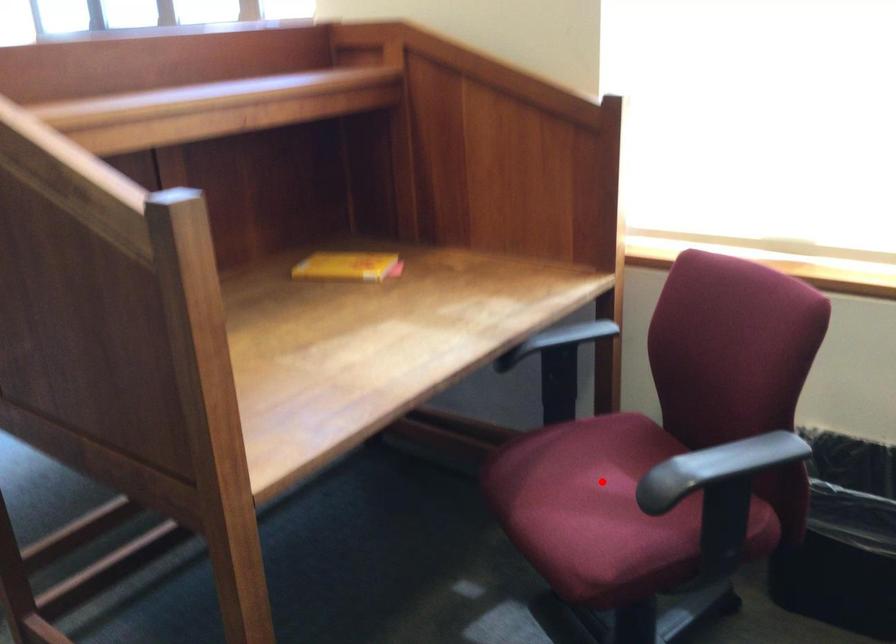
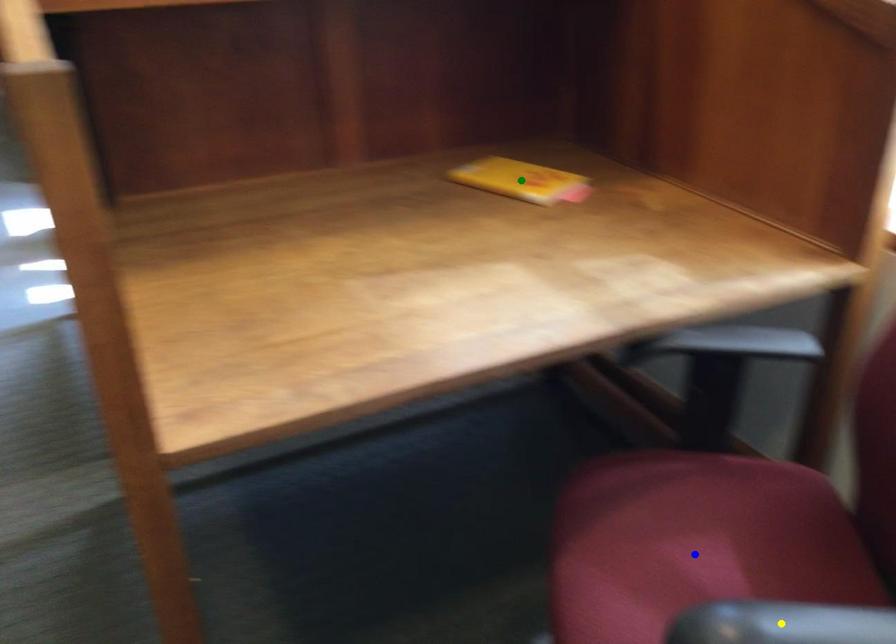
Question: I am providing you with two images of the same scene from different viewpoints. A red point is marked on the first image. You are given multiple points on the second image. Which point in image 2 is actually the same real-world point as the red point in image 1?

Choices:
 (A) yellow point
 (B) green point
 (C) blue point

Answer: (C)